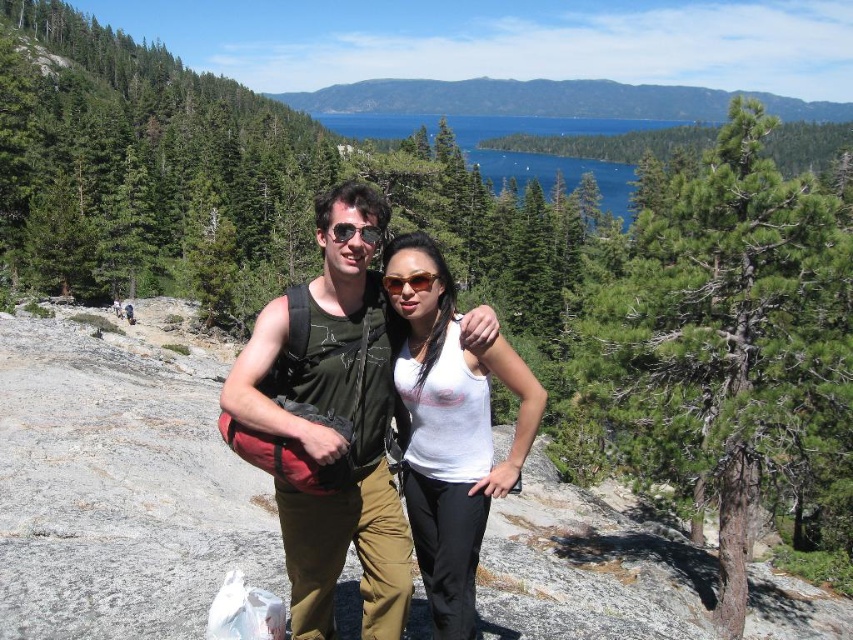
Question: Is white matte tank top at center below matte black sunglasses at center?

Choices:
 (A) no
 (B) yes

Answer: (B)

Question: Which is farther from the sunglasses at center?

Choices:
 (A) matte black sunglasses at center
 (B) green fabric backpack at center
 (C) white matte tank top at center

Answer: (B)

Question: Which object is the farthest from the green fabric backpack at center?

Choices:
 (A) sunglasses at center
 (B) matte black sunglasses at center
 (C) white matte tank top at center

Answer: (A)

Question: Based on their relative distances, which object is nearer to the green fabric backpack at center?

Choices:
 (A) matte black sunglasses at center
 (B) green forested mountain at upper center
 (C) white matte tank top at center

Answer: (C)

Question: Is green fabric backpack at center to the right of matte black sunglasses at center from the viewer's perspective?

Choices:
 (A) no
 (B) yes

Answer: (B)

Question: Does white matte tank top at center have a greater width compared to matte black sunglasses at center?

Choices:
 (A) yes
 (B) no

Answer: (A)